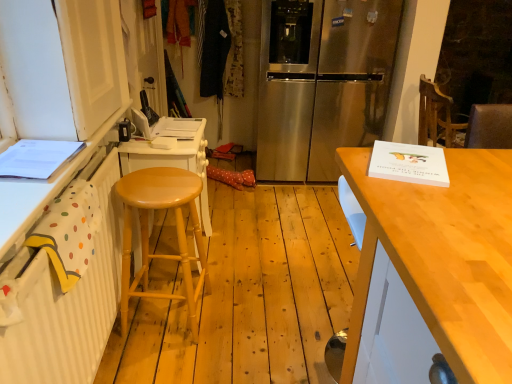
Find the location of `free space to the back side of light wood table at right`. free space to the back side of light wood table at right is located at coordinates (319, 301).